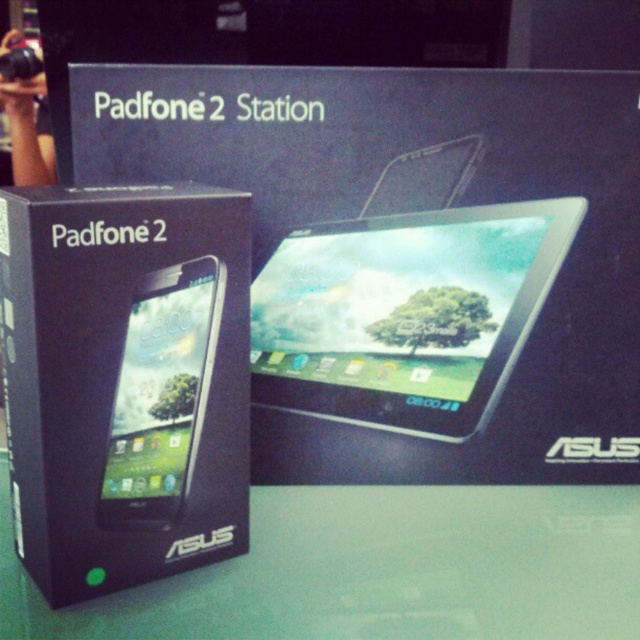
You are setting up a display for a tech store and need to arrange the black matte box at center and the matte black tablet at center on a shelf. According to the image, which object should be placed above the other to match the original arrangement?

The black matte box at center should be placed under the matte black tablet at center to maintain the original arrangement.

You are setting up a display for an electronics store and need to arrange the black matte box at center and the matte black smartphone at center on a shelf. The shelf has limited vertical space, and you must ensure that the taller item is placed at the back to avoid blocking the view of the shorter one. Which item should be placed at the back?

The black matte box at center should be placed at the back because it has a greater height compared to the matte black smartphone at center, ensuring the shorter item remains visible.

You are setting up a display for a tech store and need to place the matte black tablet at center and the matte black smartphone at center on a shelf. The shelf has a height limit of 15 cm. Can both items fit vertically on the shelf without exceeding the height limit?

The matte black tablet at center is much taller than the matte black smartphone at center. However, the exact heights aren